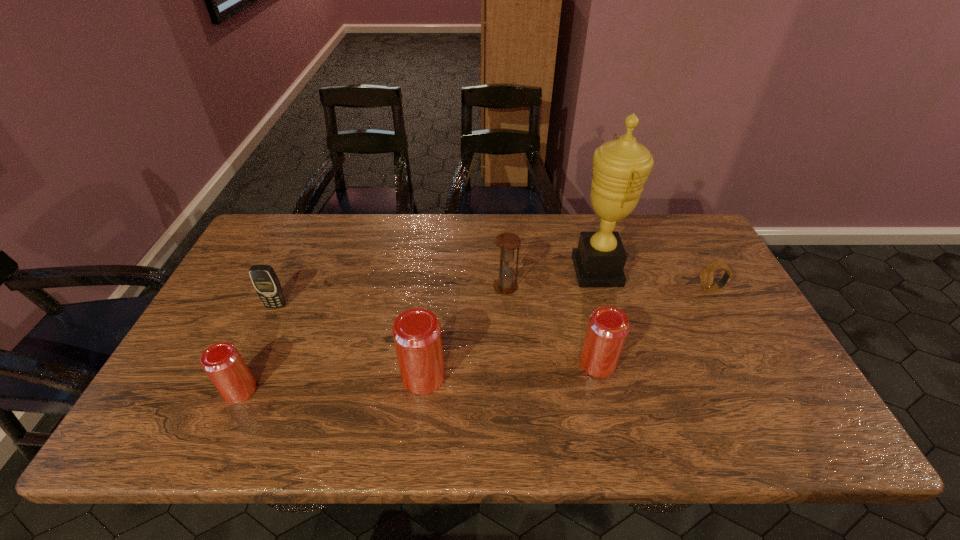
Where is `vacant area located 0.290m on the back of the rightmost beer can`? Image resolution: width=960 pixels, height=540 pixels. vacant area located 0.290m on the back of the rightmost beer can is located at coordinates (576, 273).

You are a GUI agent. You are given a task and a screenshot of the screen. Output one action in this format:
    pyautogui.click(x=<x>, y=<y>)
    Task: Click on the free region located 0.190m at the front of the trophy cup with handles
    This screenshot has width=960, height=540.
    Given the screenshot: What is the action you would take?
    pyautogui.click(x=510, y=271)

Locate an element on the screen. The width and height of the screenshot is (960, 540). vacant point located at the front of the trophy cup with handles is located at coordinates (510, 271).

Find the location of a particular element. vacant space located 0.060m at the front of the trophy cup with handles is located at coordinates pos(553,271).

I want to click on free space located 0.260m on the right of the hourglass, so click(607, 287).

Locate an element on the screen. vacant position located on the front face of the cellular telephone is located at coordinates (254, 353).

What are the coordinates of `free region located on the face of the shortest object` in the screenshot? It's located at (682, 289).

Identify the location of vacant position located 0.310m on the face of the shortest object. Image resolution: width=960 pixels, height=540 pixels. (592, 289).

This screenshot has height=540, width=960. What are the coordinates of `vacant space located 0.210m on the face of the shortest object` in the screenshot? It's located at (627, 289).

Find the location of a particular element. The height and width of the screenshot is (540, 960). object present at the far edge is located at coordinates (620, 167).